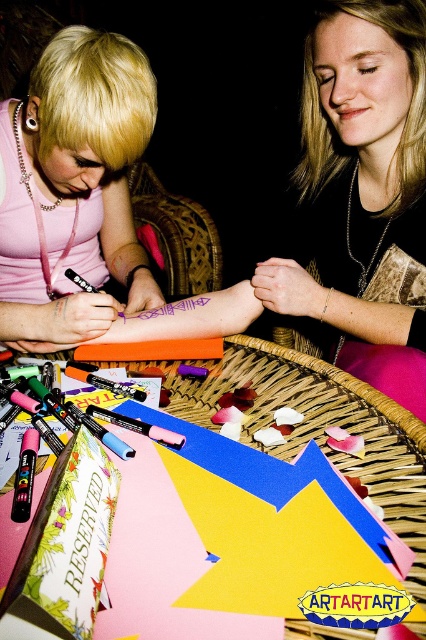
You are standing in front of the scene and want to know which point is closer to you. The points are point [385,58] and point [112,355]. Can you tell me which one is closer?

Point [385,58] is closer to you than point [112,355].

You are a photographer at the event and want to take a closeup shot of the matte pink shirt at upper left without the blonde hair at upper left blocking it. How should you adjust your camera angle?

To avoid the blonde hair at upper left blocking the matte pink shirt at upper left, you should position the camera behind the matte pink shirt at upper left since the blonde hair at upper left is in front of it and moving the camera angle behind would place the shirt in front of the hair.

You are an artist at a party and need to reach for the orange matte crayon at center while looking at the blonde hair at upper left. Which object is closer to your hand when you are facing the scene?

The orange matte crayon at center is closer to your hand than the blonde hair at upper left since it is positioned below it.